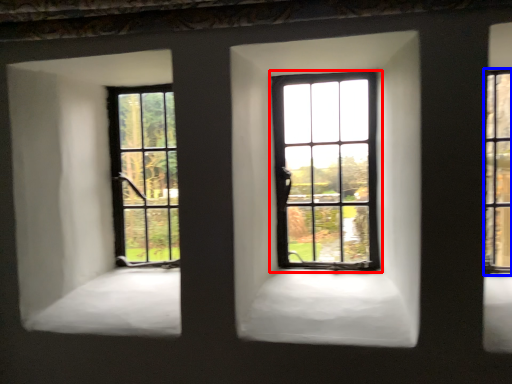
Question: Which object appears farthest to the camera in this image, window (highlighted by a red box) or window (highlighted by a blue box)?

Choices:
 (A) window
 (B) window

Answer: (A)